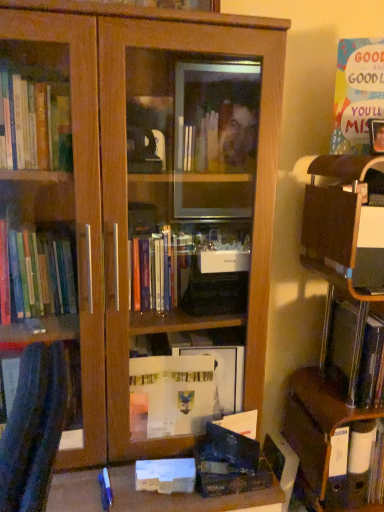
Question: Is wooden desk at right spatially inside multicolored paper at upper right, the third paperback book ordered from the bottom, or outside of it?

Choices:
 (A) inside
 (B) outside

Answer: (B)

Question: Considering the positions of wooden desk at right and multicolored paper at upper right, the 3th paperback book from the left, in the image, is wooden desk at right taller or shorter than multicolored paper at upper right, the 3th paperback book from the left,?

Choices:
 (A) tall
 (B) short

Answer: (A)

Question: Estimate the real-world distances between objects in this image. Which object is closer to the white matte paperback book at lower center, which is the 3th paperback book from right to left?

Choices:
 (A) metallic silver book at right
 (B) wooden bookcase at center
 (C) wooden desk at right
 (D) multicolored paper at upper right, the third paperback book ordered from the bottom
 (E) matte brown cabinet at lower right

Answer: (E)

Question: Based on their relative distances, which object is farther from the wooden desk at right?

Choices:
 (A) multicolored paper at upper right, arranged as the first paperback book when viewed from the top
 (B) metallic silver book at right
 (C) wooden bookcase at center
 (D) matte brown cabinet at lower right
 (E) matte black paperback book at lower center, the second paperback book positioned from the top

Answer: (C)